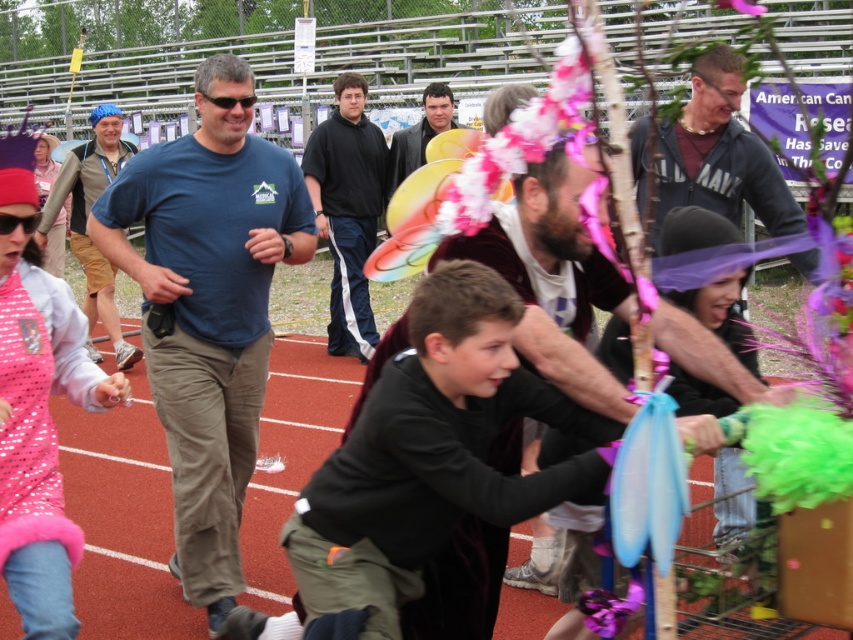
Question: Which object appears closest to the camera in this image?

Choices:
 (A) matte black jacket at center
 (B) pink sequined dress at center
 (C) velvet burgundy cape at center
 (D) black fabric at center

Answer: (C)

Question: Is black fabric at center closer to camera compared to blue fabric headband at upper left?

Choices:
 (A) no
 (B) yes

Answer: (A)

Question: Observing the image, what is the correct spatial positioning of velvet burgundy cape at center in reference to pink sequined dress at center?

Choices:
 (A) below
 (B) above

Answer: (B)

Question: Which object is the closest to the pink sequined dress at center?

Choices:
 (A) matte black jacket at center
 (B) blue cotton t-shirt at center
 (C) velvet burgundy cape at center
 (D) black matte jacket at upper center

Answer: (B)

Question: Which object is positioned farthest from the black fabric at center?

Choices:
 (A) pink sequined dress at center
 (B) black matte jacket at upper center
 (C) blue fabric headband at upper left
 (D) velvet burgundy cape at center

Answer: (D)

Question: Is blue fabric headband at upper left bigger than matte black jacket at center?

Choices:
 (A) no
 (B) yes

Answer: (B)